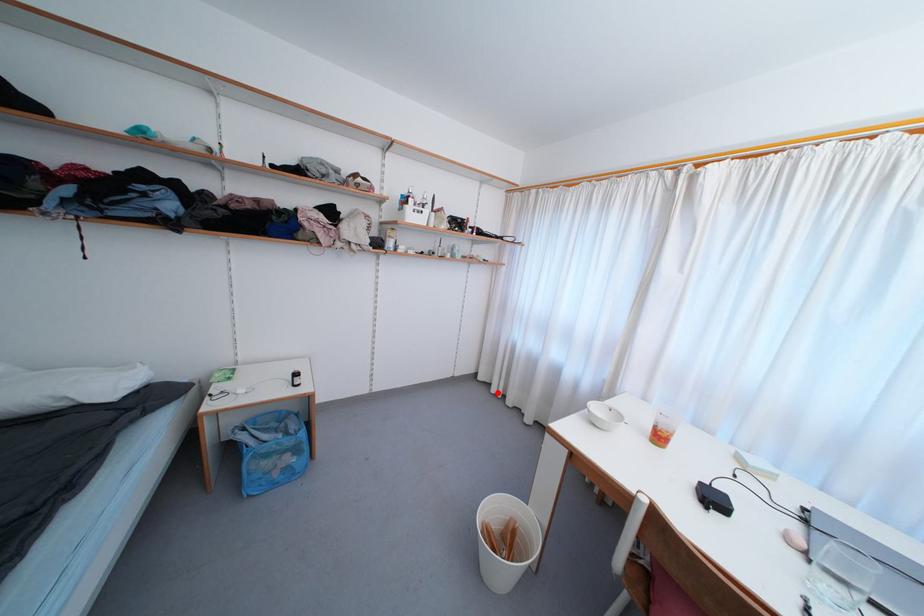
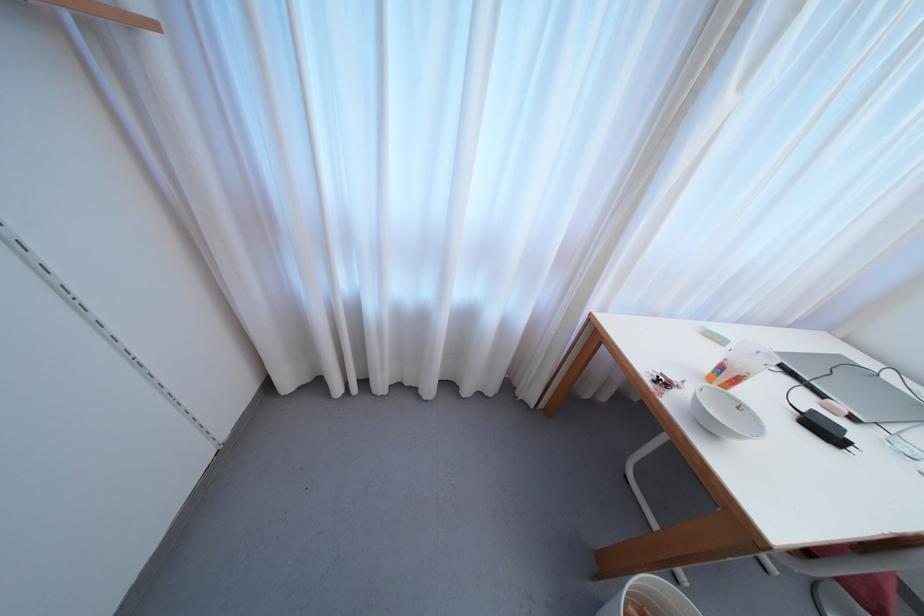
Where in the second image is the point corresponding to the highlighted location from the first image?

(342, 392)